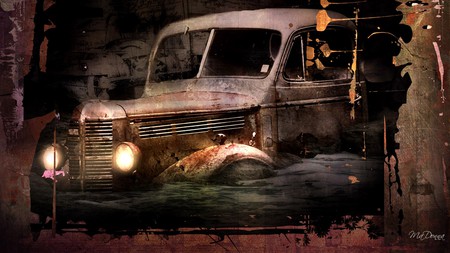
The image size is (450, 253). What are the coordinates of `sticker` in the screenshot? It's located at (261, 70).